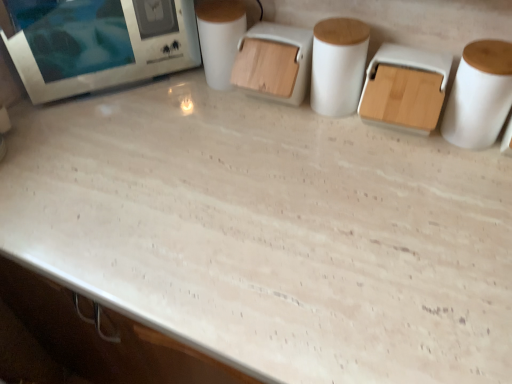
Measure the distance between white matte toilet paper at center and camera.

white matte toilet paper at center is 29.78 inches away from camera.

In order to click on white matte paper towel at center, placed as the 1th paper towel when sorted from left to right in this screenshot , I will do `click(338, 65)`.

The image size is (512, 384). What do you see at coordinates (479, 95) in the screenshot?
I see `white matte paper towel at right, the 2th paper towel from the left` at bounding box center [479, 95].

This screenshot has width=512, height=384. What are the coordinates of `wooden lid container at center` in the screenshot? It's located at (274, 62).

Where is `white matte toilet paper at center`? This screenshot has height=384, width=512. white matte toilet paper at center is located at coordinates (220, 38).

Which object is further away from the camera, white glossy microwave at upper left or white matte paper towel at right, the 2th paper towel from the left?

white glossy microwave at upper left is more distant.

Is white glossy microwave at upper left looking in the opposite direction of white matte paper towel at right, the 2th paper towel from the left?

No, white matte paper towel at right, the 2th paper towel from the left, is not at the back of white glossy microwave at upper left.

Considering the sizes of objects white glossy microwave at upper left and white matte paper towel at right, the 1th paper towel from the right, in the image provided, who is shorter, white glossy microwave at upper left or white matte paper towel at right, the 1th paper towel from the right,?

Standing shorter between the two is white matte paper towel at right, the 1th paper towel from the right.

Which of these two, white glossy microwave at upper left or white matte paper towel at right, the 1th paper towel from the right, is bigger?

With larger size is white glossy microwave at upper left.

Considering the sizes of objects wooden lid container at center and white glossy microwave at upper left in the image provided, who is taller, wooden lid container at center or white glossy microwave at upper left?

white glossy microwave at upper left is taller.

Does wooden lid container at center turn towards white glossy microwave at upper left?

No.

Considering the relative sizes of wooden lid container at center and white glossy microwave at upper left in the image provided, is wooden lid container at center bigger than white glossy microwave at upper left?

Actually, wooden lid container at center might be smaller than white glossy microwave at upper left.

What's the angular difference between wooden lid container at center and white glossy microwave at upper left's facing directions?

The angular difference between wooden lid container at center and white glossy microwave at upper left is 48.4 degrees.

From the image's perspective, who appears lower, white matte paper towel at right, the 2th paper towel from the left, or white matte toilet paper at center?

white matte paper towel at right, the 2th paper towel from the left, from the image's perspective.

Is white matte toilet paper at center at the back of white matte paper towel at right, the 1th paper towel from the right?

No.

Which point is more forward, [471,87] or [214,66]?

The point [471,87] is closer.

Is the position of white matte paper towel at right, the 2th paper towel from the left, more distant than that of white matte toilet paper at center?

No, the depth of white matte paper towel at right, the 2th paper towel from the left, is less than that of white matte toilet paper at center.

From the image's perspective, which one is positioned higher, wooden lid container at center or white matte toilet paper at center?

From the image's view, white matte toilet paper at center is above.

Is wooden lid container at center behind white matte toilet paper at center?

No, wooden lid container at center is closer to the viewer.

How distant is wooden lid container at center from white matte toilet paper at center?

wooden lid container at center is 7.48 centimeters from white matte toilet paper at center.

Is white matte toilet paper at center inside or outside of white matte paper towel at center, which is counted as the second paper towel, starting from the right?

white matte toilet paper at center exists outside the volume of white matte paper towel at center, which is counted as the second paper towel, starting from the right.

Measure the distance from white matte toilet paper at center to white matte paper towel at center, placed as the 1th paper towel when sorted from left to right.

The distance of white matte toilet paper at center from white matte paper towel at center, placed as the 1th paper towel when sorted from left to right, is 19.14 centimeters.

Is white matte toilet paper at center in contact with white matte paper towel at center, placed as the 1th paper towel when sorted from left to right?

No, white matte toilet paper at center is not touching white matte paper towel at center, placed as the 1th paper towel when sorted from left to right.

From the image's perspective, is white matte toilet paper at center located above or below white matte paper towel at center, placed as the 1th paper towel when sorted from left to right?

From the image's perspective, white matte toilet paper at center appears above white matte paper towel at center, placed as the 1th paper towel when sorted from left to right.

Can you confirm if white matte paper towel at right, the 1th paper towel from the right, is thinner than wooden lid container at center?

Yes.

Is white matte paper towel at right, the 2th paper towel from the left, facing away from wooden lid container at center?

No, white matte paper towel at right, the 2th paper towel from the left, is not facing the opposite direction of wooden lid container at center.

From the image's perspective, which is above, white matte paper towel at right, the 1th paper towel from the right, or wooden lid container at center?

wooden lid container at center, from the image's perspective.

Considering the relative positions of white matte paper towel at right, the 2th paper towel from the left, and wooden lid container at center in the image provided, is white matte paper towel at right, the 2th paper towel from the left, to the right of wooden lid container at center from the viewer's perspective?

Yes, white matte paper towel at right, the 2th paper towel from the left, is to the right of wooden lid container at center.

Is white matte paper towel at center, placed as the 1th paper towel when sorted from left to right, further to camera compared to white glossy microwave at upper left?

No, white matte paper towel at center, placed as the 1th paper towel when sorted from left to right, is closer to the camera.

Is point (358, 61) less distant than point (31, 77)?

Yes, point (358, 61) is closer to viewer.

Is white matte paper towel at center, placed as the 1th paper towel when sorted from left to right, oriented towards white glossy microwave at upper left?

No, white matte paper towel at center, placed as the 1th paper towel when sorted from left to right, does not turn towards white glossy microwave at upper left.

From a real-world perspective, is white matte paper towel at center, placed as the 1th paper towel when sorted from left to right, physically above white glossy microwave at upper left?

No, from a real-world perspective, white matte paper towel at center, placed as the 1th paper towel when sorted from left to right, is not on top of white glossy microwave at upper left.

Identify the location of home appliance above the white matte paper towel at right, the 2th paper towel from the left (from a real-world perspective). Image resolution: width=512 pixels, height=384 pixels. (98, 43).

Where is `appliance below the white glossy microwave at upper left (from the image's perspective)`? appliance below the white glossy microwave at upper left (from the image's perspective) is located at coordinates (274, 62).

Which object lies further to the anchor point white glossy microwave at upper left, white matte paper towel at right, the 2th paper towel from the left, or white matte toilet paper at center?

Based on the image, white matte paper towel at right, the 2th paper towel from the left, appears to be further to white glossy microwave at upper left.

Looking at the image, which one is located further to white matte paper towel at center, placed as the 1th paper towel when sorted from left to right, wooden lid container at center or white glossy microwave at upper left?

Based on the image, white glossy microwave at upper left appears to be further to white matte paper towel at center, placed as the 1th paper towel when sorted from left to right.

From the image, which object appears to be farther from white matte paper towel at right, the 1th paper towel from the right, white glossy microwave at upper left or white matte paper towel at center, placed as the 1th paper towel when sorted from left to right?

Among the two, white glossy microwave at upper left is located further to white matte paper towel at right, the 1th paper towel from the right.

Which object lies further to the anchor point wooden lid container at center, white matte toilet paper at center or white glossy microwave at upper left?

white glossy microwave at upper left.

Based on the photo, when comparing their distances from wooden lid container at center, does white matte toilet paper at center or white matte paper towel at center, which is counted as the second paper towel, starting from the right, seem further?

white matte paper towel at center, which is counted as the second paper towel, starting from the right, is further to wooden lid container at center.

When comparing their distances from white matte paper towel at right, the 2th paper towel from the left, does wooden lid container at center or white matte paper towel at center, which is counted as the second paper towel, starting from the right, seem closer?

Among the two, white matte paper towel at center, which is counted as the second paper towel, starting from the right, is located nearer to white matte paper towel at right, the 2th paper towel from the left.

When comparing their distances from white matte paper towel at right, the 1th paper towel from the right, does wooden lid container at center or white glossy microwave at upper left seem closer?

Based on the image, wooden lid container at center appears to be nearer to white matte paper towel at right, the 1th paper towel from the right.

In the scene shown: Which object lies nearer to the anchor point white matte paper towel at center, placed as the 1th paper towel when sorted from left to right, white glossy microwave at upper left or white matte toilet paper at center?

white matte toilet paper at center is closer to white matte paper towel at center, placed as the 1th paper towel when sorted from left to right.

Image resolution: width=512 pixels, height=384 pixels. In order to click on appliance between white glossy microwave at upper left and white matte paper towel at center, which is counted as the second paper towel, starting from the right in this screenshot , I will do `click(274, 62)`.

Where is `paper towel situated between white glossy microwave at upper left and white matte paper towel at right, the 2th paper towel from the left, from left to right`? paper towel situated between white glossy microwave at upper left and white matte paper towel at right, the 2th paper towel from the left, from left to right is located at coordinates (338, 65).

This screenshot has height=384, width=512. Find the location of `appliance situated between white glossy microwave at upper left and white matte paper towel at right, the 2th paper towel from the left, from left to right`. appliance situated between white glossy microwave at upper left and white matte paper towel at right, the 2th paper towel from the left, from left to right is located at coordinates (274, 62).

Identify the location of toilet paper between white glossy microwave at upper left and white matte paper towel at center, which is counted as the second paper towel, starting from the right, in the horizontal direction. The height and width of the screenshot is (384, 512). (220, 38).